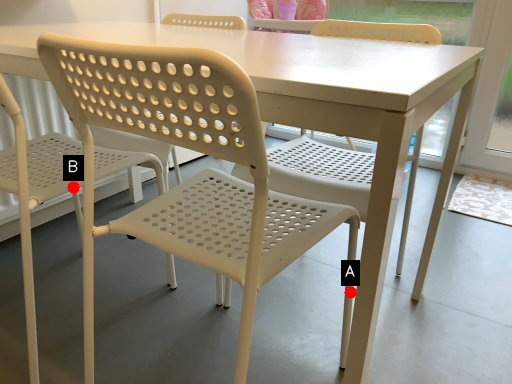
Question: Two points are circled on the image, labeled by A and B beside each circle. Which point is farther from the camera taking this photo?

Choices:
 (A) A is further
 (B) B is further

Answer: (B)